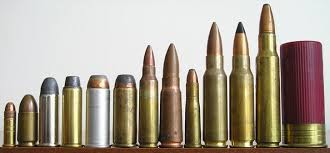
Find the location of a particular element. This screenshot has width=330, height=153. table/counter is located at coordinates (59, 148), (144, 150), (243, 149).